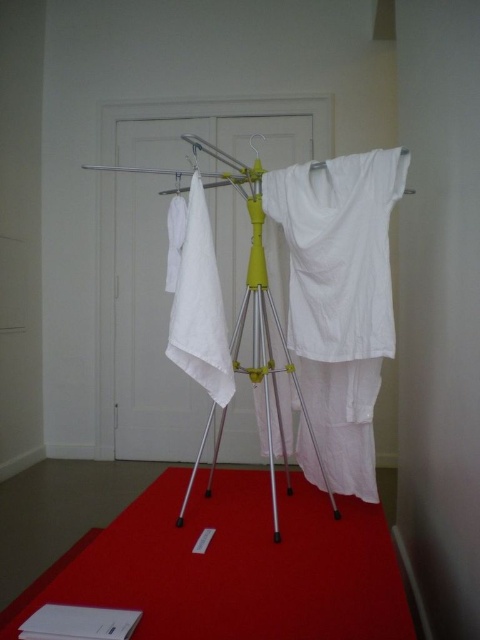
Does red carpet at lower center come behind yellow metallic tripod at center?

No, red carpet at lower center is closer to the viewer.

Who is shorter, red carpet at lower center or yellow metallic tripod at center?

red carpet at lower center is shorter.

The image size is (480, 640). I want to click on red carpet at lower center, so click(238, 564).